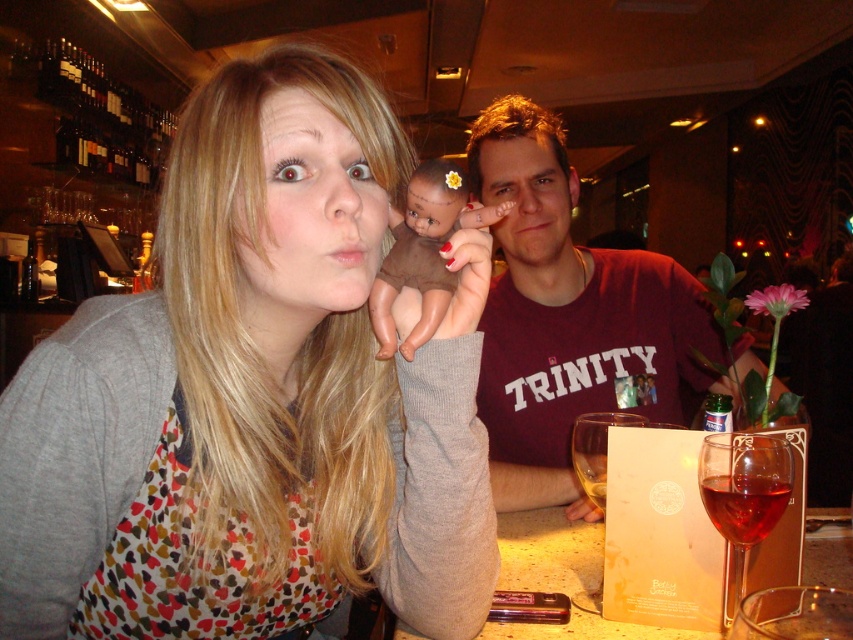
Is point (573, 317) less distant than point (602, 509)?

That is False.

Does maroon cotton shirt at center have a greater height compared to red glass wine at lower right?

Correct, maroon cotton shirt at center is much taller as red glass wine at lower right.

Identify the location of maroon cotton shirt at center. This screenshot has width=853, height=640. (572, 316).

Find the location of a particular element. The height and width of the screenshot is (640, 853). maroon cotton shirt at center is located at coordinates (572, 316).

Is dark glass bottles at upper left taller than brown matte baby doll at center?

Correct, dark glass bottles at upper left is much taller as brown matte baby doll at center.

Consider the image. Which is more to the left, dark glass bottles at upper left or brown matte baby doll at center?

dark glass bottles at upper left

At what (x,y) coordinates should I click in order to perform the action: click on dark glass bottles at upper left. Please return your answer as a coordinate pair (x, y). Looking at the image, I should click on (96, 112).

Is the position of translucent glass wine at center right more distant than that of red glass at center?

No, it is in front of red glass at center.

Does point (706, 496) come closer to viewer compared to point (753, 516)?

That is False.

What are the coordinates of `translucent glass wine at center right` in the screenshot? It's located at (744, 492).